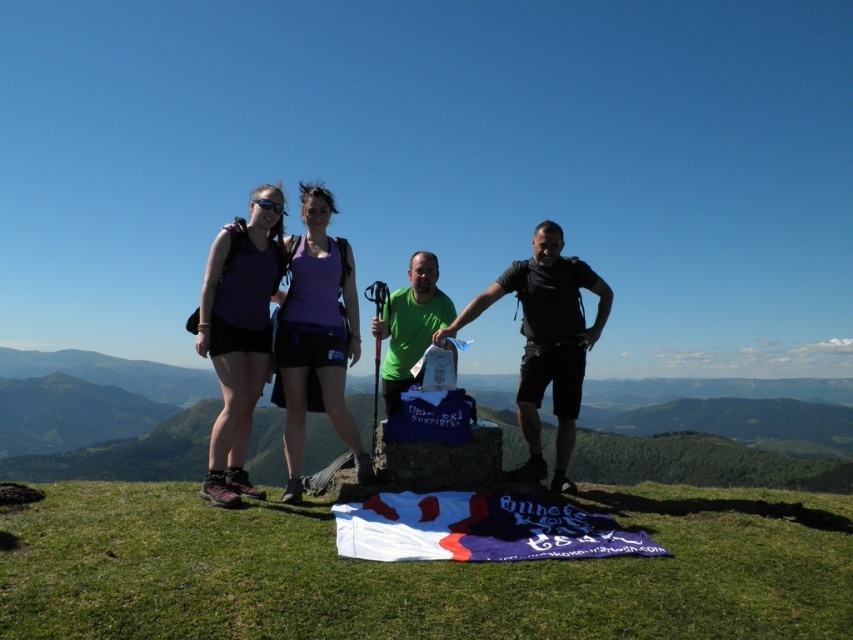
From the picture: You are a photographer trying to capture a group photo of the black matte shirt at center and the black matte goggles at upper center. Since you want to frame them both in the shot, where should you position the goggles relative to the shirt?

The black matte shirt at center is to the right of the black matte goggles at upper center, so to frame both in the shot, position the goggles to the left of the shirt.

You are planning to take a photo of the group on the grassy hilltop. You want to ensure that both the black matte shirt at center and the green matte shirt at center are clearly visible. Since you want the taller person to stand behind the shorter one, which shirt should be placed where?

The black matte shirt at center is taller than the green matte shirt at center. To have the taller person behind the shorter one, the person in the black matte shirt at center should stand behind the person in the green matte shirt at center.

You are a photographer trying to capture the group photo of the black matte shirt at center and the green matte shirt at center. Since you want them to be centered in the frame, which one should you adjust their position so that they are aligned to the left of the current position?

The black matte shirt at center is positioned on the right side of green matte shirt at center. To center them both in the frame, you should move the black matte shirt at center to the left so that it aligns with the green matte shirt at center.